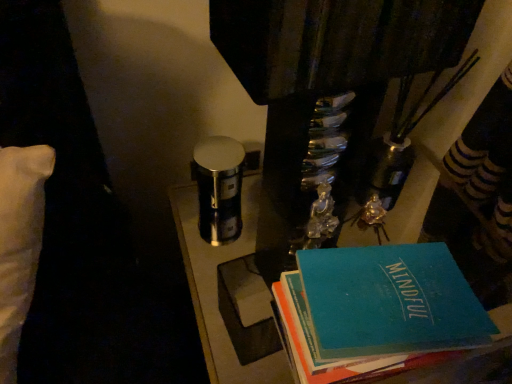
Question: Does point (334, 352) appear closer or farther from the camera than point (199, 268)?

Choices:
 (A) farther
 (B) closer

Answer: (B)

Question: From a real-world perspective, relative to metallic/reflective table at center, is teal matte book at lower right vertically above or below?

Choices:
 (A) below
 (B) above

Answer: (B)

Question: Is teal matte book at lower right in front of or behind metallic/reflective table at center in the image?

Choices:
 (A) behind
 (B) front

Answer: (B)

Question: Considering the positions of point (219, 246) and point (335, 332), is point (219, 246) closer or farther from the camera than point (335, 332)?

Choices:
 (A) farther
 (B) closer

Answer: (A)

Question: Is metallic/reflective table at center wider or thinner than teal matte book at lower right?

Choices:
 (A) thin
 (B) wide

Answer: (B)

Question: Considering the positions of metallic/reflective table at center and teal matte book at lower right in the image, is metallic/reflective table at center taller or shorter than teal matte book at lower right?

Choices:
 (A) short
 (B) tall

Answer: (B)

Question: Visually, is metallic/reflective table at center positioned to the left or to the right of teal matte book at lower right?

Choices:
 (A) left
 (B) right

Answer: (A)